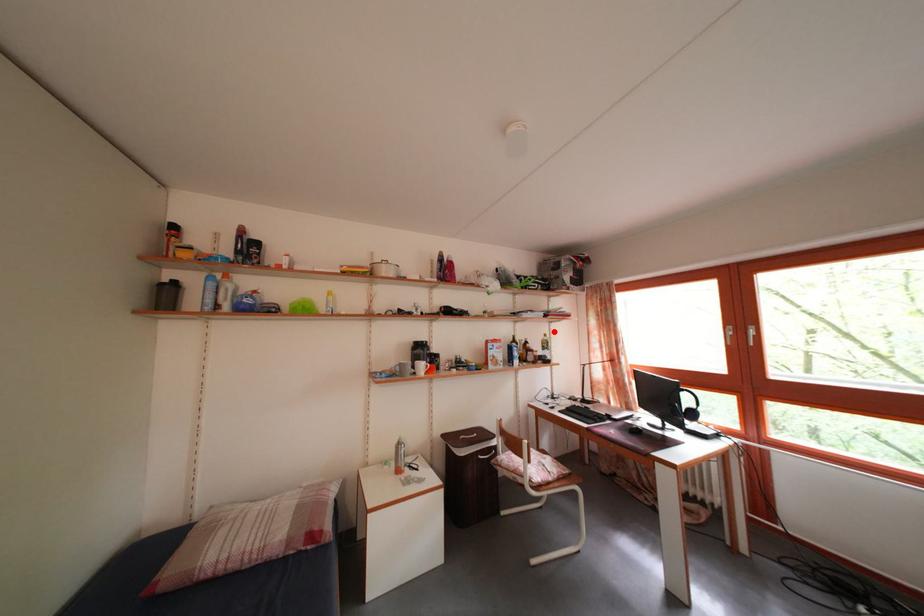
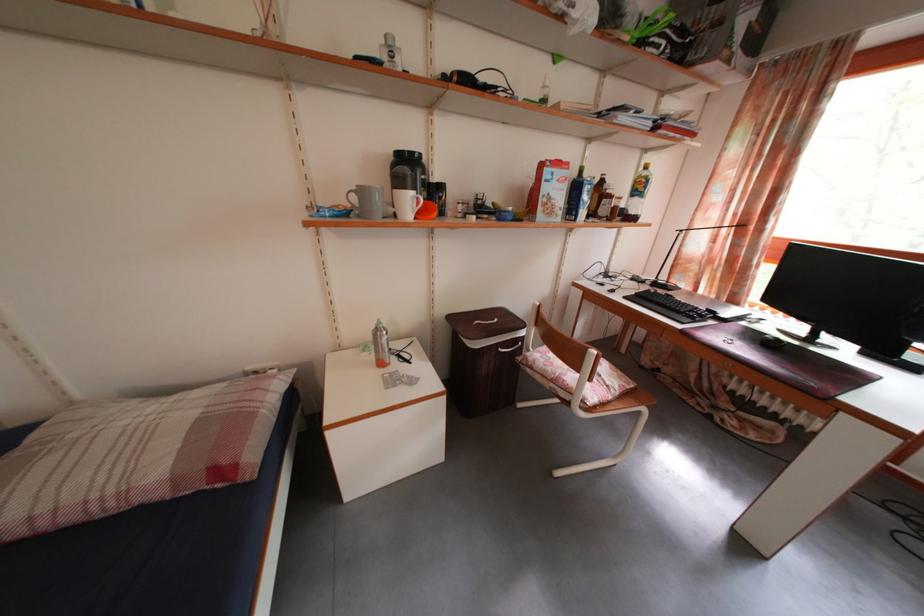
Where in the second image is the point corresponding to the highlighted location from the first image?

(643, 161)